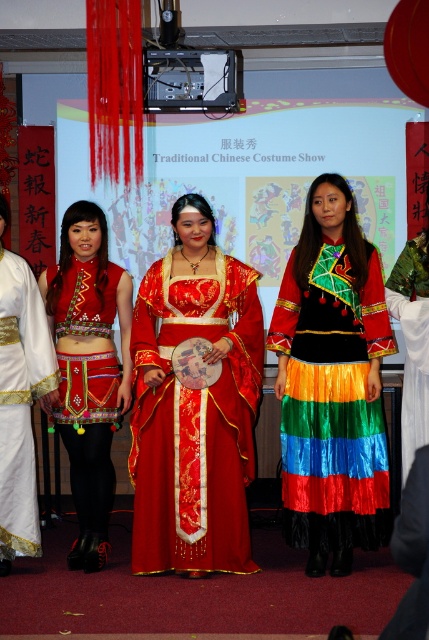
Does silky red dress at center appear over silky rainbow skirt at center?

Incorrect, silky red dress at center is not positioned above silky rainbow skirt at center.

Between point (138, 353) and point (425, 432), which one is positioned behind?

Point (138, 353)

Describe the element at coordinates (193, 404) in the screenshot. This screenshot has height=640, width=429. I see `silky red dress at center` at that location.

Where is `silky red dress at center`? This screenshot has height=640, width=429. silky red dress at center is located at coordinates (193, 404).

From the picture: Is shiny multicolored skirt at center behind silk red dress at center?

No, it is in front of silk red dress at center.

I want to click on shiny multicolored skirt at center, so click(332, 385).

Is silky red dress at center smaller than shiny multicolored skirt at center?

Incorrect, silky red dress at center is not smaller in size than shiny multicolored skirt at center.

Is point (148, 291) positioned before point (377, 392)?

That is False.

Between point (199, 426) and point (334, 200), which one is positioned in front?

Point (199, 426)

You are a GUI agent. You are given a task and a screenshot of the screen. Output one action in this format:
    pyautogui.click(x=<x>, y=<y>)
    Task: Click on the silky red dress at center
    This screenshot has width=429, height=640.
    Given the screenshot: What is the action you would take?
    pyautogui.click(x=193, y=404)